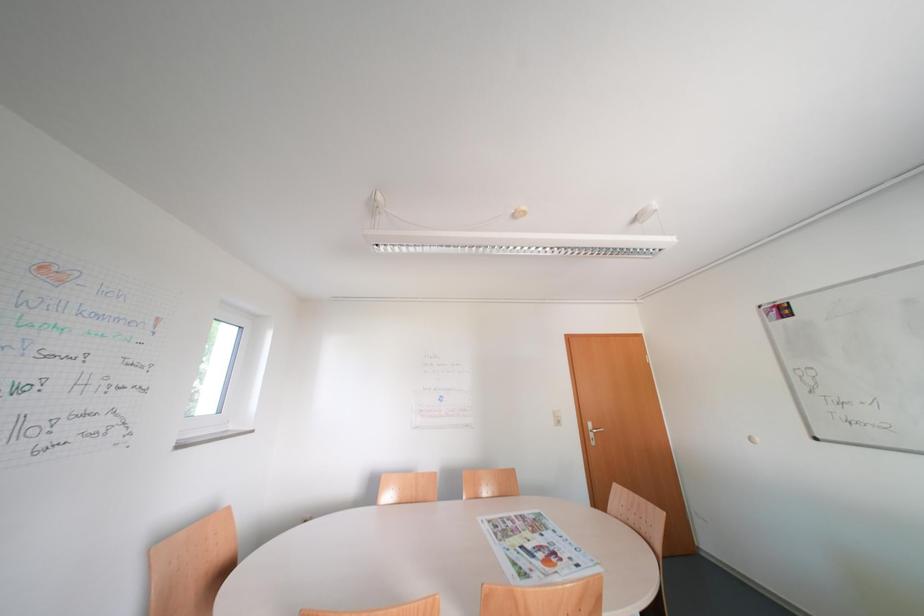
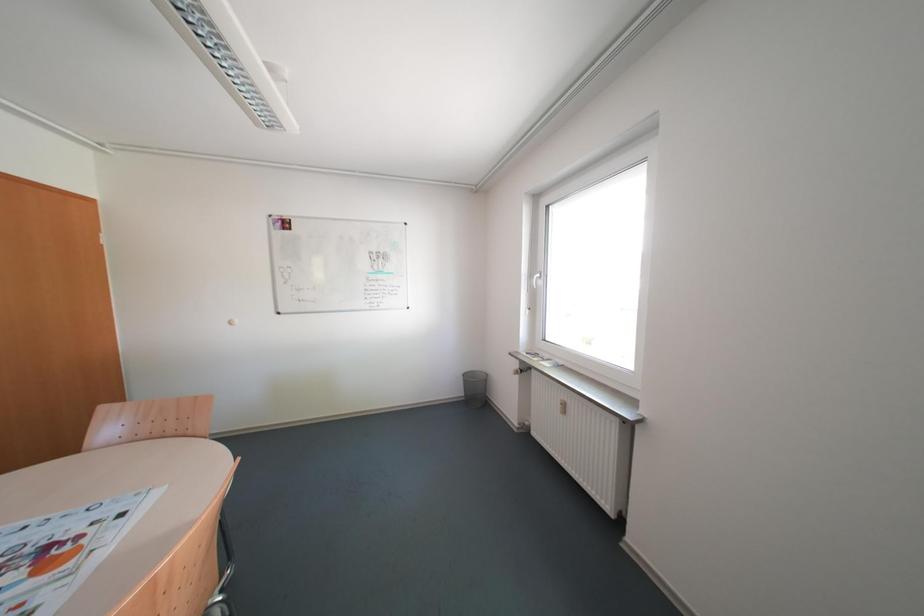
Question: How did the camera likely rotate?

Choices:
 (A) Left
 (B) Right
 (C) Up
 (D) Down

Answer: (B)